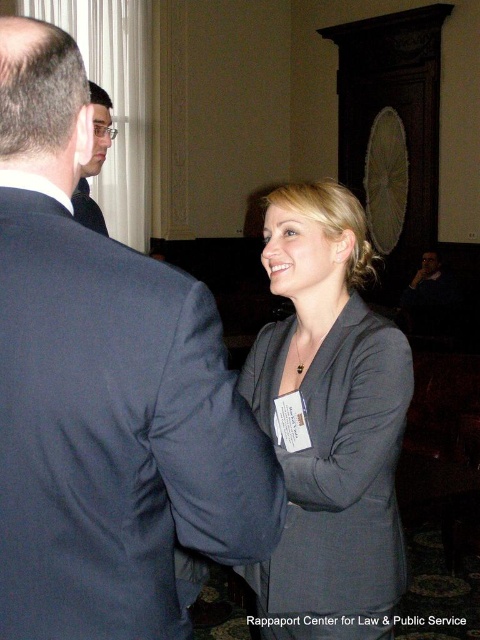
Question: Among these points, which one is nearest to the camera?

Choices:
 (A) (x=338, y=419)
 (B) (x=446, y=333)
 (C) (x=98, y=260)
 (D) (x=95, y=227)

Answer: (C)

Question: Which object appears farthest from the camera in this image?

Choices:
 (A) dark blue suit at lower right
 (B) dark blue suit at center
 (C) matte gray blazer at center

Answer: (A)

Question: Which object appears closest to the camera in this image?

Choices:
 (A) dark blue suit at lower right
 (B) matte gray blazer at center

Answer: (B)

Question: Does dark blue suit at center appear on the right side of matte black suit at left?

Choices:
 (A) yes
 (B) no

Answer: (A)

Question: Can you confirm if dark blue suit at center is bigger than matte gray blazer at center?

Choices:
 (A) yes
 (B) no

Answer: (B)

Question: Is dark blue suit at center wider than dark blue suit at lower right?

Choices:
 (A) no
 (B) yes

Answer: (A)